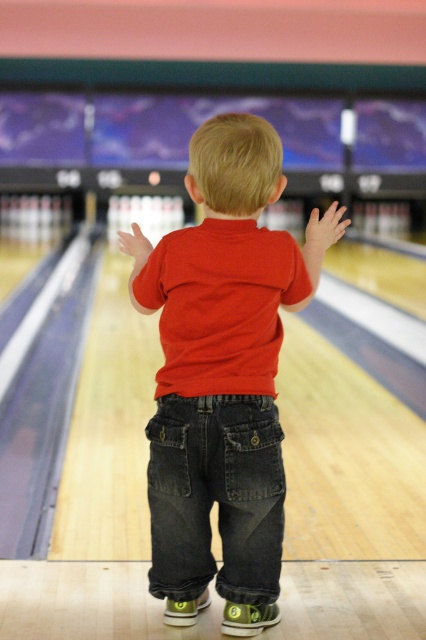
Question: Which point appears closest to the camera in this image?

Choices:
 (A) (207, 488)
 (B) (213, 492)

Answer: (B)

Question: Which object appears closest to the camera in this image?

Choices:
 (A) dark blue denim jeans at center
 (B) red cotton shirt at center

Answer: (B)

Question: Can you confirm if red cotton shirt at center is positioned to the right of dark blue denim jeans at center?

Choices:
 (A) yes
 (B) no

Answer: (A)

Question: Does red cotton shirt at center have a smaller size compared to dark blue denim jeans at center?

Choices:
 (A) yes
 (B) no

Answer: (B)

Question: Which object is closer to the camera taking this photo?

Choices:
 (A) red cotton shirt at center
 (B) dark blue denim jeans at center

Answer: (A)

Question: Can you confirm if red cotton shirt at center is wider than dark blue denim jeans at center?

Choices:
 (A) yes
 (B) no

Answer: (A)